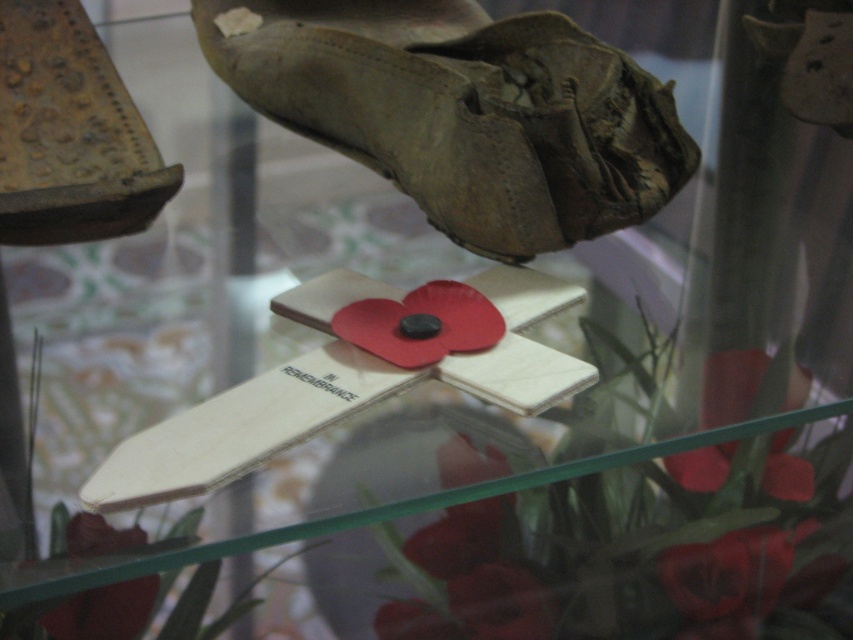
You are a museum curator arranging an exhibit. You have two shoes to place in the display case. The leather shoe at upper center and the rusty metal shoe at upper left. Which shoe should you place closer to the center of the display case to maintain balance with the central wooden cross?

The leather shoe at upper center is bigger than the rusty metal shoe at upper left, so placing the larger leather shoe at upper center closer to the center of the display case would help balance its size with the central wooden cross.

You are standing in front of a display case with a wooden cross and a red poppy. There is also a worn leather shoe in the background. A point labeled as point (x=465, y=113) is marked in the image. Which object is this point located on?

The point labeled (x=465, y=113) is located on the leather shoe at upper center.